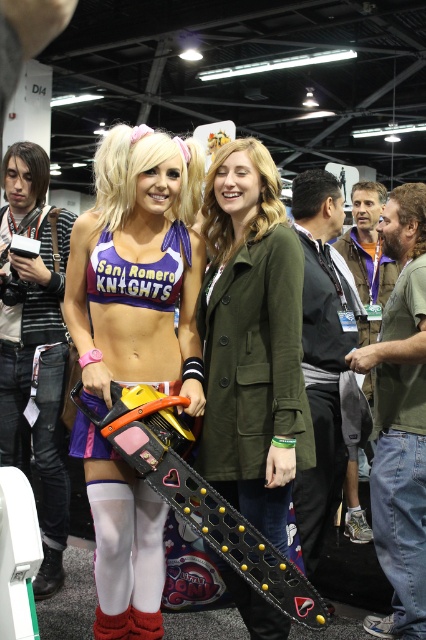
Question: Which of these objects is positioned farthest from the purple matte sports bra at center?

Choices:
 (A) purple fabric bikini top at center
 (B) green matte jacket at center

Answer: (B)

Question: Which point is closer to the camera?

Choices:
 (A) (143, 310)
 (B) (138, 452)
 (C) (307, 419)

Answer: (B)

Question: Is purple matte sports bra at center wider than purple fabric bikini top at center?

Choices:
 (A) yes
 (B) no

Answer: (A)

Question: Is green matte jacket at center above purple fabric bikini top at center?

Choices:
 (A) yes
 (B) no

Answer: (B)

Question: Based on their relative distances, which object is farther from the black plastic chainsaw at lower center?

Choices:
 (A) green matte jacket at center
 (B) purple fabric bikini top at center
 (C) purple matte sports bra at center

Answer: (C)

Question: Does black plastic chainsaw at lower center appear over purple fabric bikini top at center?

Choices:
 (A) yes
 (B) no

Answer: (B)